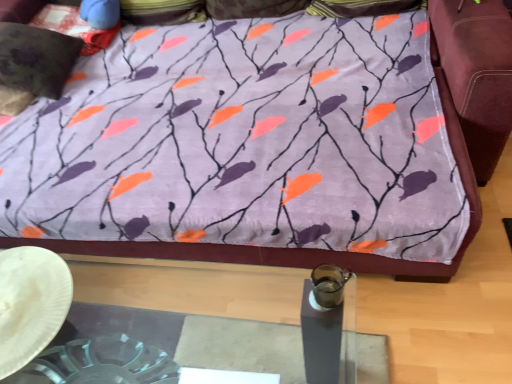
Question: Is velvety black pillow at upper left, the first pillow positioned from the bottom, positioned behind purple fabric bedspread at upper center?

Choices:
 (A) yes
 (B) no

Answer: (A)

Question: Considering the relative sizes of velvety black pillow at upper left, which is counted as the 3th pillow, starting from the top, and purple fabric bedspread at upper center in the image provided, is velvety black pillow at upper left, which is counted as the 3th pillow, starting from the top, taller than purple fabric bedspread at upper center?

Choices:
 (A) yes
 (B) no

Answer: (A)

Question: Is purple fabric bedspread at upper center at the back of velvety black pillow at upper left, the first pillow positioned from the bottom?

Choices:
 (A) no
 (B) yes

Answer: (A)

Question: Is velvety black pillow at upper left, which is counted as the 3th pillow, starting from the top, outside of purple fabric bedspread at upper center?

Choices:
 (A) no
 (B) yes

Answer: (B)

Question: From a real-world perspective, is velvety black pillow at upper left, which is counted as the 3th pillow, starting from the top, physically above purple fabric bedspread at upper center?

Choices:
 (A) no
 (B) yes

Answer: (B)

Question: Does velvety black pillow at upper left, the first pillow positioned from the bottom, come in front of purple fabric bedspread at upper center?

Choices:
 (A) no
 (B) yes

Answer: (A)

Question: Is velvety dark brown pillow at upper left, marked as the 2th pillow in a bottom-to-top arrangement, completely or partially outside of purple fabric pillow at upper center, which appears as the 3th pillow when ordered from the bottom?

Choices:
 (A) yes
 (B) no

Answer: (A)

Question: From the image's perspective, is velvety dark brown pillow at upper left, marked as the 2th pillow in a bottom-to-top arrangement, above purple fabric pillow at upper center, which appears as the 3th pillow when ordered from the bottom?

Choices:
 (A) no
 (B) yes

Answer: (A)

Question: Does velvety dark brown pillow at upper left, which appears as the second pillow when viewed from the top, have a greater height compared to purple fabric pillow at upper center, which appears as the 3th pillow when ordered from the bottom?

Choices:
 (A) no
 (B) yes

Answer: (A)

Question: From a real-world perspective, is velvety dark brown pillow at upper left, marked as the 2th pillow in a bottom-to-top arrangement, located higher than purple fabric pillow at upper center, which appears as the 3th pillow when ordered from the bottom?

Choices:
 (A) yes
 (B) no

Answer: (B)

Question: Considering the relative sizes of velvety dark brown pillow at upper left, marked as the 2th pillow in a bottom-to-top arrangement, and purple fabric pillow at upper center, the first pillow when ordered from top to bottom, in the image provided, is velvety dark brown pillow at upper left, marked as the 2th pillow in a bottom-to-top arrangement, thinner than purple fabric pillow at upper center, the first pillow when ordered from top to bottom,?

Choices:
 (A) yes
 (B) no

Answer: (B)

Question: Considering the relative sizes of velvety dark brown pillow at upper left, marked as the 2th pillow in a bottom-to-top arrangement, and purple fabric pillow at upper center, the first pillow when ordered from top to bottom, in the image provided, is velvety dark brown pillow at upper left, marked as the 2th pillow in a bottom-to-top arrangement, bigger than purple fabric pillow at upper center, the first pillow when ordered from top to bottom,?

Choices:
 (A) yes
 (B) no

Answer: (B)

Question: Can you confirm if velvety black pillow at upper left, the first pillow positioned from the bottom, is bigger than purple fabric pillow at upper center, the first pillow when ordered from top to bottom?

Choices:
 (A) yes
 (B) no

Answer: (B)